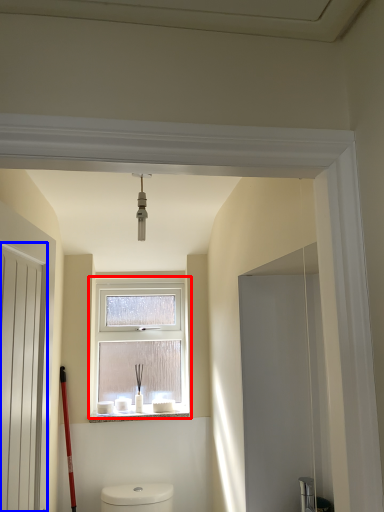
Question: Which object is closer to the camera taking this photo, window (highlighted by a red box) or screen door (highlighted by a blue box)?

Choices:
 (A) window
 (B) screen door

Answer: (B)